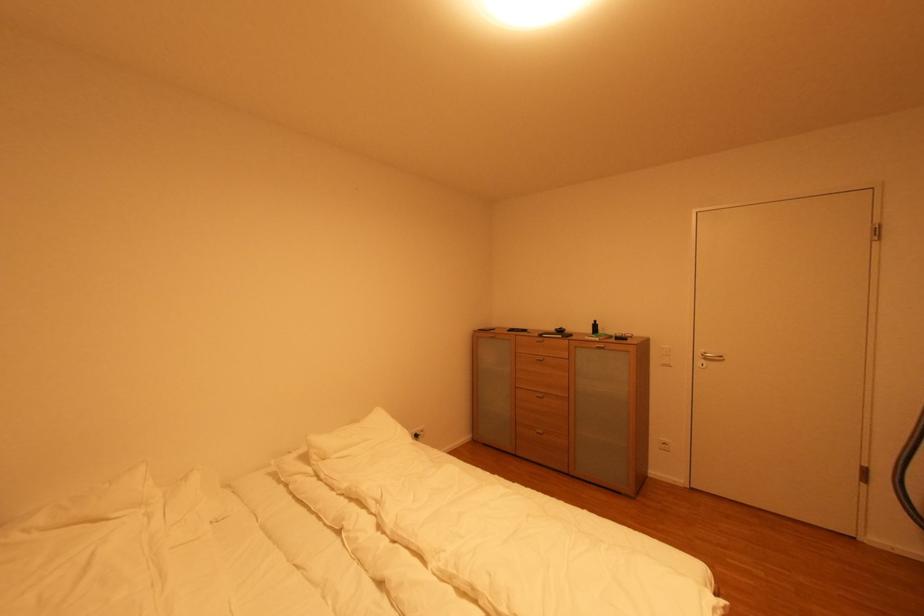
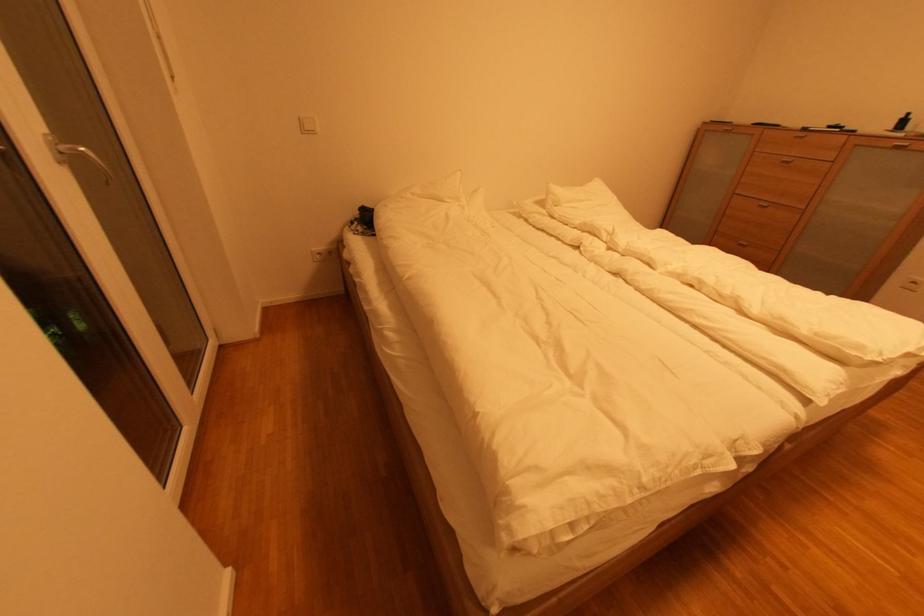
Find the pixel in the second image that matches [543,361] in the first image.

(789, 163)